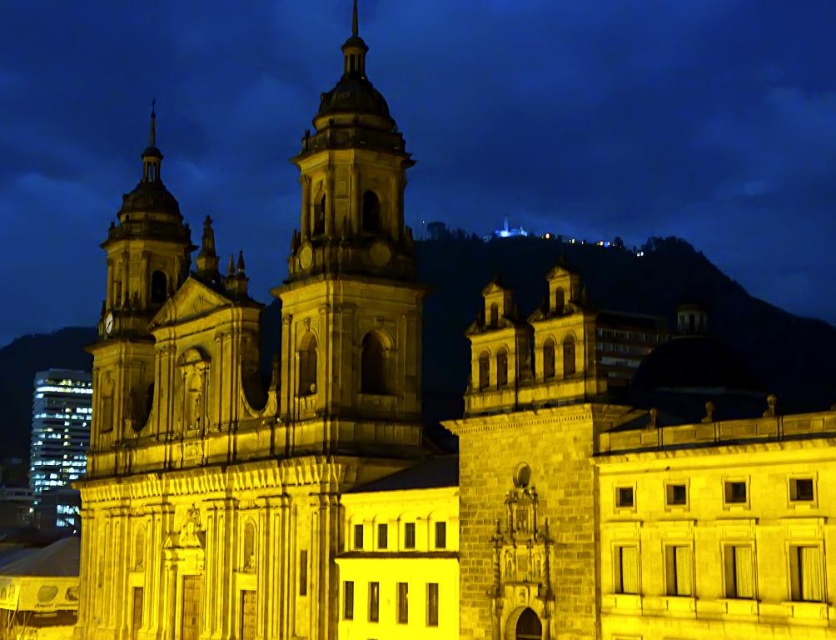
You are an architect analyzing the building structure. You observe the white stone tower at center and the matte stone bell tower at center. Which one is located lower in the image?

The white stone tower at center is positioned under the matte stone bell tower at center, so it is located lower in the image.

You are an architect analyzing the building facade. You observe the white stone tower at center and the matte stone bell tower at center. Which one has a greater width according to the available information?

The white stone tower at center might be wider than matte stone bell tower at center.

You are a drone operator tasked with capturing aerial footage of the white stone tower at center and the matte stone bell tower at center. Your drone has a maximum flight range of 30 feet. Can you fly the drone from one tower to the other without exceeding its range?

The distance between the white stone tower at center and the matte stone bell tower at center is 31.28 feet, which exceeds the drone operator drone maximum flight range of 30 feet. Therefore, the drone cannot fly from one tower to the other without exceeding its range.